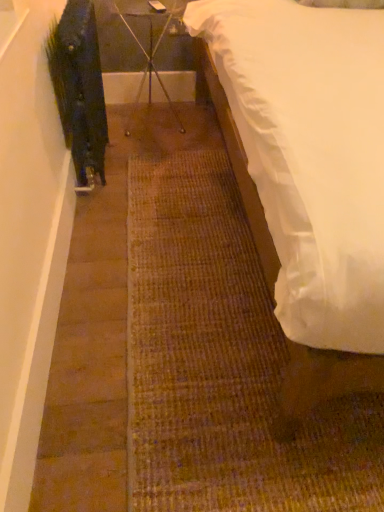
Locate an element on the screen. This screenshot has width=384, height=512. green matte plant at left is located at coordinates (79, 87).

In order to click on white satin bed at right in this screenshot , I will do `click(309, 177)`.

Can you confirm if green matte plant at left is wider than white satin bed at right?

Incorrect, the width of green matte plant at left does not surpass that of white satin bed at right.

The width and height of the screenshot is (384, 512). Identify the location of plant located behind the white satin bed at right. (79, 87).

Would you consider green matte plant at left to be distant from white satin bed at right?

That's not correct — green matte plant at left is a little close to white satin bed at right.

Between point (168, 94) and point (255, 3), which one is positioned in front?

The point (255, 3) is closer to the camera.

Which object is further away from the camera taking this photo, metal tripod at center or white satin bed at right?

metal tripod at center is further away from the camera.

Locate an element on the screen. bed that is in front of the metal tripod at center is located at coordinates (309, 177).

Would you say white satin bed at right is a long distance from green matte plant at left?

white satin bed at right is actually quite close to green matte plant at left.

Considering their positions, is white satin bed at right located in front of or behind green matte plant at left?

Visually, white satin bed at right is located in front of green matte plant at left.

Is white satin bed at right facing towards green matte plant at left?

No, white satin bed at right does not turn towards green matte plant at left.

The height and width of the screenshot is (512, 384). Identify the location of plant that is above the white satin bed at right (from the image's perspective). (79, 87).

Considering the positions of objects green matte plant at left and metal tripod at center in the image provided, who is in front, green matte plant at left or metal tripod at center?

green matte plant at left is closer to the camera.

How much distance is there between green matte plant at left and metal tripod at center?

22.73 inches.

Locate an element on the screen. furniture that is behind the green matte plant at left is located at coordinates (151, 41).

Is green matte plant at left aimed at metal tripod at center?

No, green matte plant at left is not oriented towards metal tripod at center.

Which object is wider, metal tripod at center or green matte plant at left?

metal tripod at center.

From a real-world perspective, which object rests below the other?

In real-world perspective, metal tripod at center is lower.

Consider the image. Between metal tripod at center and green matte plant at left, which one has less height?

metal tripod at center is shorter.

From a real-world perspective, is white satin bed at right on metal tripod at center?

Yes, from a real-world perspective, white satin bed at right is above metal tripod at center.

Considering the sizes of objects white satin bed at right and metal tripod at center in the image provided, who is thinner, white satin bed at right or metal tripod at center?

metal tripod at center is thinner.

In terms of height, does white satin bed at right look taller or shorter compared to metal tripod at center?

Clearly, white satin bed at right is taller compared to metal tripod at center.

Is white satin bed at right far from metal tripod at center?

Yes, white satin bed at right and metal tripod at center are located far from each other.

You are a GUI agent. You are given a task and a screenshot of the screen. Output one action in this format:
    pyautogui.click(x=<x>, y=<y>)
    Task: Click on the plant below the white satin bed at right (from a real-world perspective)
    The image size is (384, 512).
    Given the screenshot: What is the action you would take?
    pyautogui.click(x=79, y=87)

At what (x,y) coordinates should I click in order to perform the action: click on bed that appears below the metal tripod at center (from the image's perspective). Please return your answer as a coordinate pair (x, y). This screenshot has width=384, height=512. Looking at the image, I should click on (309, 177).

Considering their positions, is metal tripod at center positioned closer to white satin bed at right than green matte plant at left?

Among the two, green matte plant at left is located nearer to white satin bed at right.

From the image, which object appears to be farther from metal tripod at center, green matte plant at left or white satin bed at right?

white satin bed at right.

From the image, which object appears to be farther from green matte plant at left, metal tripod at center or white satin bed at right?

Among the two, white satin bed at right is located further to green matte plant at left.

When comparing their distances from green matte plant at left, does white satin bed at right or metal tripod at center seem closer?

metal tripod at center lies closer to green matte plant at left than the other object.

Considering their positions, is green matte plant at left positioned closer to white satin bed at right than metal tripod at center?

Among the two, green matte plant at left is located nearer to white satin bed at right.

Based on their spatial positions, is white satin bed at right or green matte plant at left closer to metal tripod at center?

The object closer to metal tripod at center is green matte plant at left.

Identify the location of plant located between white satin bed at right and metal tripod at center in the depth direction. Image resolution: width=384 pixels, height=512 pixels. (79, 87).